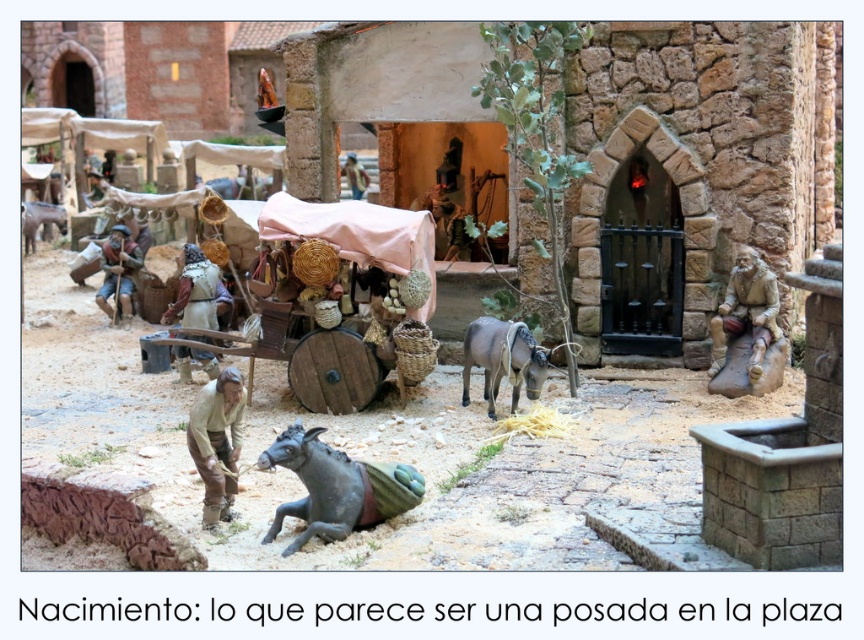
Question: Where is gray matte donkey at center located in relation to gray matte donkey at left in the image?

Choices:
 (A) above
 (B) below

Answer: (B)

Question: Is black matte donkey at lower center to the left of gray matte donkey at center from the viewer's perspective?

Choices:
 (A) yes
 (B) no

Answer: (A)

Question: Is wooden cart at center below gray matte donkey at left?

Choices:
 (A) yes
 (B) no

Answer: (A)

Question: Among these objects, which one is nearest to the camera?

Choices:
 (A) black matte donkey at lower center
 (B) gray matte donkey at center
 (C) wooden cart at center

Answer: (A)

Question: Among these objects, which one is nearest to the camera?

Choices:
 (A) gray matte donkey at center
 (B) black matte donkey at lower center

Answer: (B)

Question: Which point is closer to the camera?

Choices:
 (A) (33, 221)
 (B) (327, 506)
 (C) (522, 381)

Answer: (B)